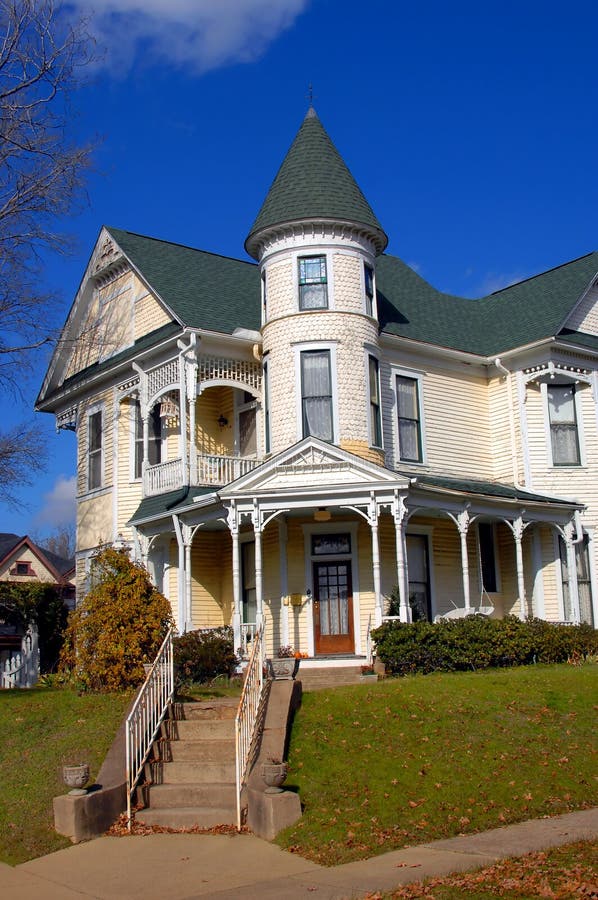
Locate an element on the screen. front door is located at coordinates (332, 598).